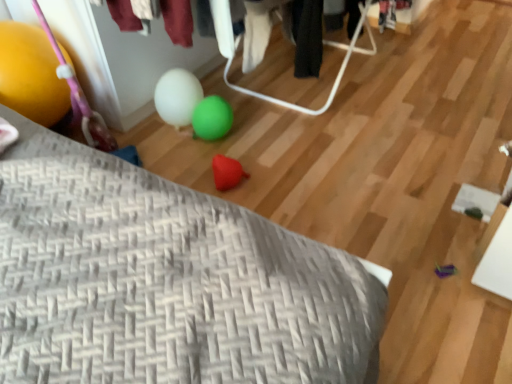
The width and height of the screenshot is (512, 384). What do you see at coordinates (31, 74) in the screenshot?
I see `yellow rubber balloon at left` at bounding box center [31, 74].

I want to click on rubber heart at center, so 227,172.

The image size is (512, 384). What do you see at coordinates (227, 172) in the screenshot?
I see `rubber heart at center` at bounding box center [227, 172].

This screenshot has width=512, height=384. In order to click on yellow rubber balloon at left in this screenshot , I will do `click(31, 74)`.

Looking at this image, can you tell me how much gray woven pillow at lower left and yellow rubber balloon at left differ in facing direction?

89.9 degrees separate the facing orientations of gray woven pillow at lower left and yellow rubber balloon at left.

Considering the relative sizes of gray woven pillow at lower left and yellow rubber balloon at left in the image provided, is gray woven pillow at lower left shorter than yellow rubber balloon at left?

Correct, gray woven pillow at lower left is not as tall as yellow rubber balloon at left.

Who is more distant, gray woven pillow at lower left or yellow rubber balloon at left?

yellow rubber balloon at left is further away from the camera.

Are gray woven pillow at lower left and yellow rubber balloon at left beside each other?

No.

From the image's perspective, is rubber heart at center located above or below gray woven pillow at lower left?

Based on their image positions, rubber heart at center is located beneath gray woven pillow at lower left.

The width and height of the screenshot is (512, 384). I want to click on toy above the gray woven pillow at lower left (from a real-world perspective), so click(x=227, y=172).

Are rubber heart at center and gray woven pillow at lower left beside each other?

No.

Measure the distance from gray woven pillow at lower left to rubber heart at center.

gray woven pillow at lower left is 26.60 inches away from rubber heart at center.

What's the angular difference between gray woven pillow at lower left and rubber heart at center's facing directions?

89.9 degrees separate the facing orientations of gray woven pillow at lower left and rubber heart at center.

Is gray woven pillow at lower left outside of rubber heart at center?

Yes, gray woven pillow at lower left is not within rubber heart at center.

Which point is more distant from viewer, (331, 352) or (238, 164)?

The point (238, 164) is behind.

From the image's perspective, between yellow rubber balloon at left and rubber heart at center, who is located below?

rubber heart at center, from the image's perspective.

Is yellow rubber balloon at left touching rubber heart at center?

No, yellow rubber balloon at left is not beside rubber heart at center.

From a real-world perspective, is yellow rubber balloon at left physically above rubber heart at center?

Yes, from a real-world perspective, yellow rubber balloon at left is on top of rubber heart at center.

Does yellow rubber balloon at left have a lesser width compared to rubber heart at center?

In fact, yellow rubber balloon at left might be wider than rubber heart at center.

From a real-world perspective, relative to yellow rubber balloon at left, is rubber heart at center vertically above or below?

In terms of real-world spatial position, rubber heart at center is below yellow rubber balloon at left.

Does rubber heart at center have a lesser width compared to yellow rubber balloon at left?

Yes.

Considering the positions of objects rubber heart at center and yellow rubber balloon at left in the image provided, who is behind, rubber heart at center or yellow rubber balloon at left?

rubber heart at center.

Considering the positions of objects rubber heart at center and yellow rubber balloon at left in the image provided, who is more to the left, rubber heart at center or yellow rubber balloon at left?

yellow rubber balloon at left.

Which is more distant, (51, 108) or (69, 324)?

Point (51, 108)

Which object is more forward, yellow rubber balloon at left or gray woven pillow at lower left?

Positioned in front is gray woven pillow at lower left.

Is yellow rubber balloon at left next to gray woven pillow at lower left?

No, yellow rubber balloon at left is not with gray woven pillow at lower left.

Can you confirm if yellow rubber balloon at left is thinner than gray woven pillow at lower left?

Yes.

Identify the location of balloon behind the gray woven pillow at lower left. This screenshot has height=384, width=512. (31, 74).

I want to click on toy that is above the gray woven pillow at lower left (from a real-world perspective), so click(227, 172).

Estimate the real-world distances between objects in this image. Which object is closer to yellow rubber balloon at left, gray woven pillow at lower left or rubber heart at center?

The object closer to yellow rubber balloon at left is gray woven pillow at lower left.

Considering their positions, is yellow rubber balloon at left positioned further to rubber heart at center than gray woven pillow at lower left?

Among the two, gray woven pillow at lower left is located further to rubber heart at center.

Considering their positions, is gray woven pillow at lower left positioned further to rubber heart at center than yellow rubber balloon at left?

gray woven pillow at lower left is further to rubber heart at center.

Considering their positions, is rubber heart at center positioned closer to gray woven pillow at lower left than yellow rubber balloon at left?

yellow rubber balloon at left is closer to gray woven pillow at lower left.

When comparing their distances from gray woven pillow at lower left, does yellow rubber balloon at left or rubber heart at center seem closer?

Based on the image, yellow rubber balloon at left appears to be nearer to gray woven pillow at lower left.

Estimate the real-world distances between objects in this image. Which object is further from yellow rubber balloon at left, rubber heart at center or gray woven pillow at lower left?

Among the two, rubber heart at center is located further to yellow rubber balloon at left.

Where is `toy situated between yellow rubber balloon at left and gray woven pillow at lower left from left to right`? This screenshot has width=512, height=384. toy situated between yellow rubber balloon at left and gray woven pillow at lower left from left to right is located at coordinates (227, 172).